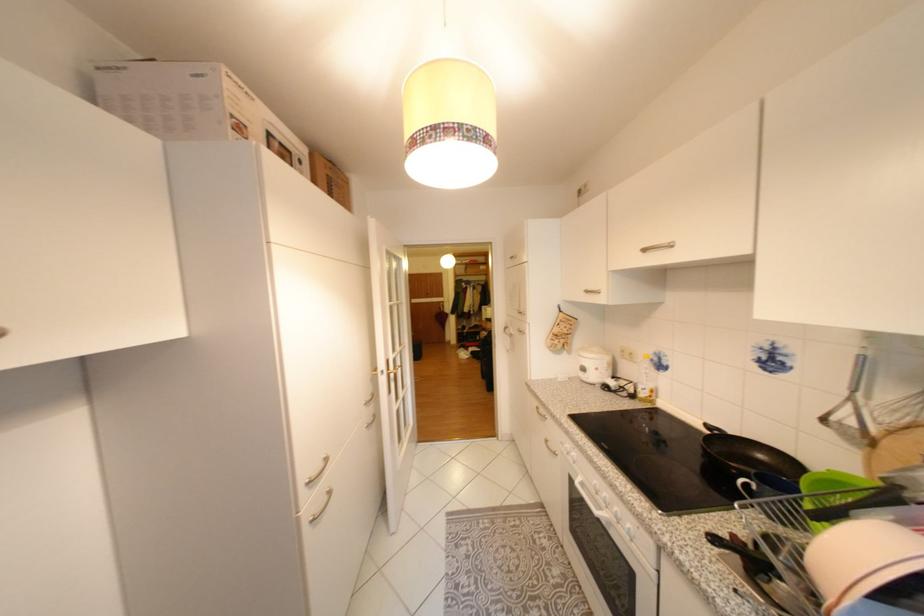
Where is `white rice cooker`? white rice cooker is located at coordinates (593, 365).